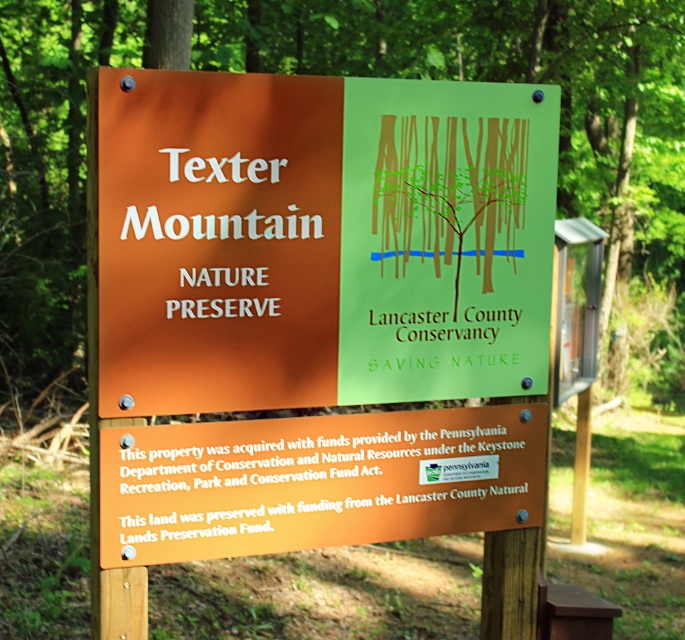
You are a hiker planning to take a photo of both the matte orange sign at center and the green matte signboard at center. Since you want to ensure both are clearly visible in the frame, which sign should you focus on first to account for their sizes?

The matte orange sign at center is larger in size than the green matte signboard at center, so you should focus on the matte orange sign at center first to ensure it fits well in the frame, then adjust to include the smaller green matte signboard at center.

You are a hiker standing at the base of Texter Mountain. You see the matte orange sign at center and the green matte signboard at center. Which sign is closer to you?

The matte orange sign at center and green matte signboard at center are both at the same distance from you since they are both located at the center of the image.

What are the coordinates of the matte orange sign at center?

The coordinates of the matte orange sign at center are at point (319, 241).